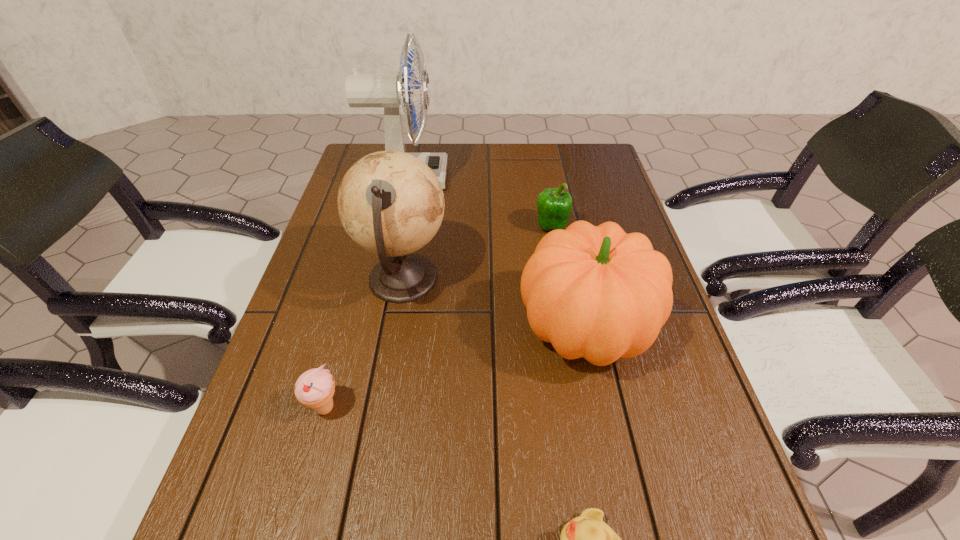
Image resolution: width=960 pixels, height=540 pixels. Identify the location of the closest object relative to the farthest object. (390, 203).

Image resolution: width=960 pixels, height=540 pixels. I want to click on vacant space that satisfies the following two spatial constraints: 1. on the front-facing side of the farthest object; 2. on the right side of the pumpkin, so click(x=374, y=330).

Where is `free space that satisfies the following two spatial constraints: 1. on the front-facing side of the bell pepper; 2. on the left side of the farthest object`? free space that satisfies the following two spatial constraints: 1. on the front-facing side of the bell pepper; 2. on the left side of the farthest object is located at coordinates (396, 226).